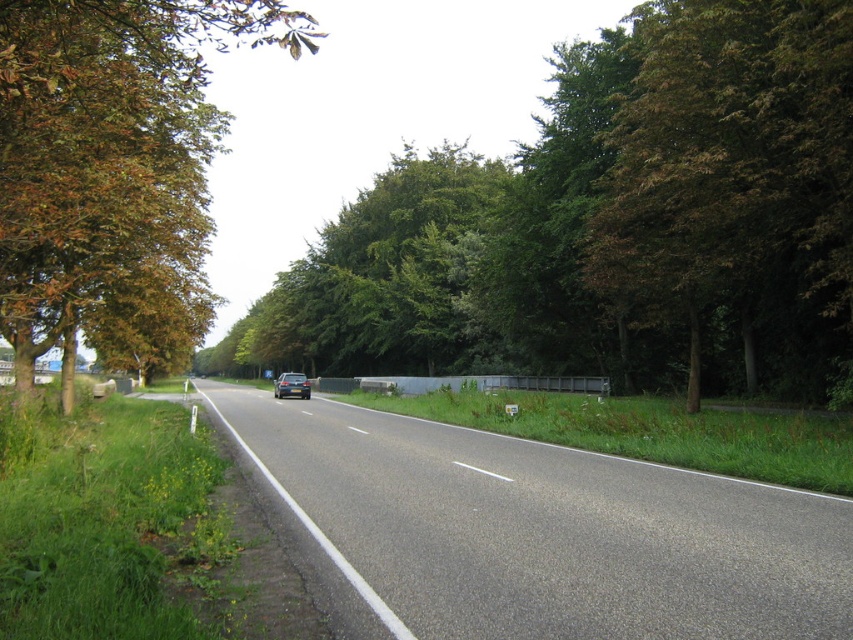
Which is below, asphalt road at center or green leafy tree at right?

asphalt road at center

Is point (349, 490) farther from viewer compared to point (688, 13)?

No, it is not.

The image size is (853, 640). I want to click on asphalt road at center, so click(x=532, y=532).

This screenshot has width=853, height=640. What do you see at coordinates (610, 225) in the screenshot?
I see `green leafy tree at center` at bounding box center [610, 225].

Which of these two, green leafy tree at center or brown leafy tree at left, stands shorter?

With less height is green leafy tree at center.

Who is more distant from viewer, (631, 234) or (88, 145)?

Point (631, 234)

Where is `green leafy tree at center`? Image resolution: width=853 pixels, height=640 pixels. green leafy tree at center is located at coordinates (610, 225).

Which is more to the left, green leafy tree at center or green leafy tree at right?

Positioned to the left is green leafy tree at center.

Does green leafy tree at center have a larger size compared to green leafy tree at right?

Correct, green leafy tree at center is larger in size than green leafy tree at right.

Between point (451, 364) and point (839, 44), which one is positioned in front?

Point (839, 44) is more forward.

This screenshot has height=640, width=853. In order to click on green leafy tree at center in this screenshot , I will do `click(610, 225)`.